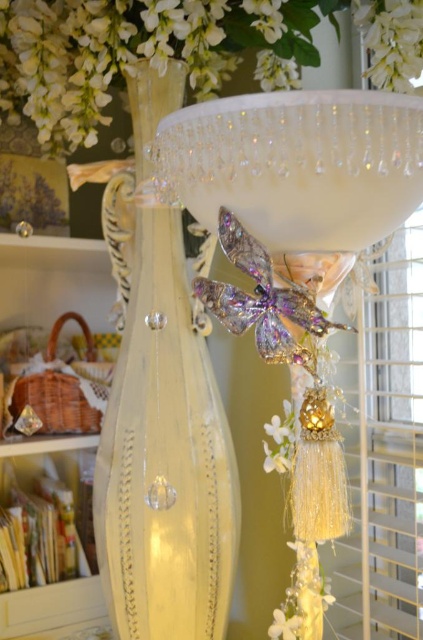
Question: Is translucent glass bowl at upper center bigger than white matte flower at lower center?

Choices:
 (A) yes
 (B) no

Answer: (A)

Question: Is clear crystal bowl at upper center thinner than translucent glass bowl at upper center?

Choices:
 (A) no
 (B) yes

Answer: (B)

Question: Among these points, which one is nearest to the camera?

Choices:
 (A) (129, 420)
 (B) (296, 186)
 (C) (376, 29)
 (D) (282, 628)

Answer: (B)

Question: Among these objects, which one is farthest from the camera?

Choices:
 (A) white matte flower at upper center
 (B) clear crystal bowl at upper center
 (C) clear glass vase at center
 (D) white matte flower at lower center

Answer: (D)

Question: Does clear crystal bowl at upper center appear on the right side of white matte flower at lower center?

Choices:
 (A) yes
 (B) no

Answer: (B)

Question: Which object is closer to the camera taking this photo?

Choices:
 (A) white matte flower at upper center
 (B) clear glass vase at center
 (C) translucent glass bowl at upper center
 (D) white matte flower at lower center

Answer: (C)